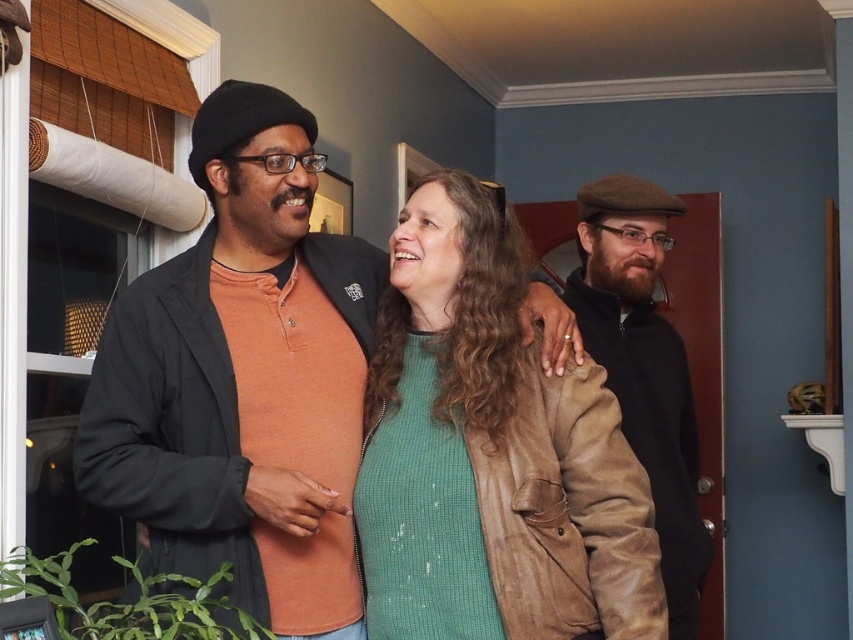
You are taking a photo of two points in the scene. The first point is at coordinates point [189,424] and the second is at point [697,611]. Which point will appear larger in your photo?

Point [189,424] is closer to the camera than point [697,611], so it will appear larger in the photo.

You are trying to decide which clothing item to take for a cold day. You see the brown leather jacket at center and the green textured sweater at center in the image. Which one is thinner and might be better for layering?

The brown leather jacket at center is thinner than the green textured sweater at center, so it would be better for layering.

You are organizing a charity clothing drive and need to determine which item can fit into a small donation box. Based on the scene, which item is smaller between the green textured sweater at center and the brown suede cap at right?

The green textured sweater at center is smaller than the brown suede cap at right, so it can fit into the small donation box.